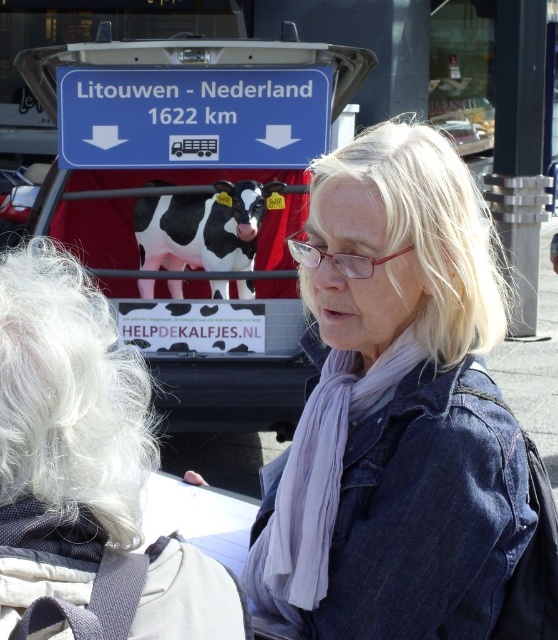
Question: Can you confirm if blue plastic sign at upper center is smaller than linen scarf at center?

Choices:
 (A) yes
 (B) no

Answer: (A)

Question: Is denim jacket at center thinner than linen scarf at center?

Choices:
 (A) no
 (B) yes

Answer: (A)

Question: Which point appears closest to the camera in this image?

Choices:
 (A) (309, 147)
 (B) (259, 42)
 (C) (412, 362)

Answer: (C)

Question: Which point appears farthest from the camera in this image?

Choices:
 (A) (165, 154)
 (B) (286, 220)
 (C) (237, 214)

Answer: (B)

Question: Which point is closer to the camera taking this photo?

Choices:
 (A) (117, 115)
 (B) (172, 168)
 (C) (165, 236)
 (D) (492, 625)

Answer: (D)

Question: Is denim jacket at center smaller than linen scarf at center?

Choices:
 (A) no
 (B) yes

Answer: (A)